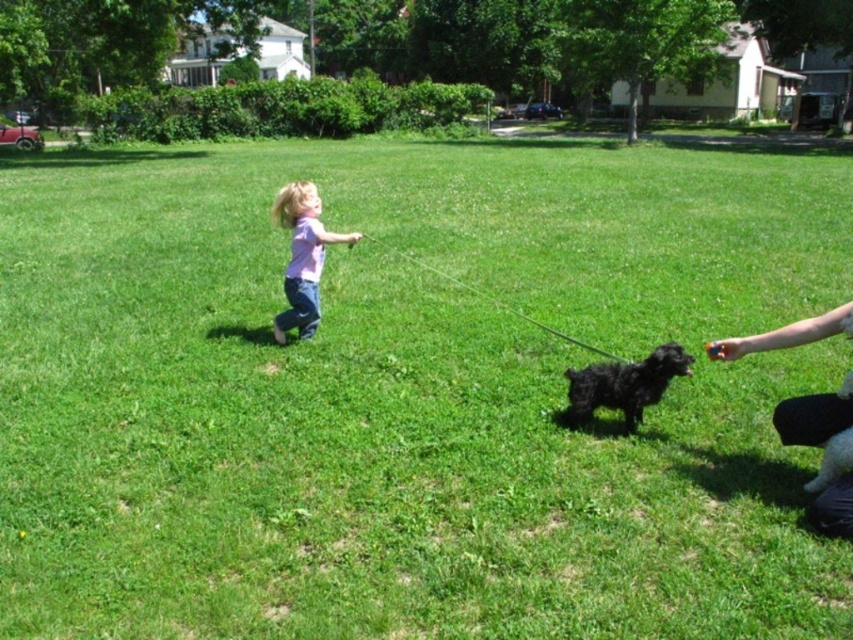
You are a photographer trying to capture the child and the dog in the park. You notice the pink cotton shirt at center and the black fuzzy dog at center. Which object is positioned more to the left in the image?

The pink cotton shirt at center is to the left of the black fuzzy dog at center, so the pink cotton shirt at center is positioned more to the left in the image.

You are a photographer trying to capture a clear shot of both the pink cotton shirt at center and the black fuzzy dog at center. Since you want both subjects to be in focus, which one should you adjust your camera focus on first?

You should focus on the pink cotton shirt at center first because it is closer to the viewer than the black fuzzy dog at center, ensuring both will be in focus when focused on the closer object.

You are a drone operator trying to capture a photo of the pink cotton shirt at center and the black fuzzy dog at center. Your camera has a minimum focus distance of 10 feet. Can you focus on both subjects simultaneously?

The pink cotton shirt at center is 9.11 feet away from the black fuzzy dog at center. Since the minimum focus distance is 10 feet, the camera cannot focus on both subjects at the same time because they are too close to each other.